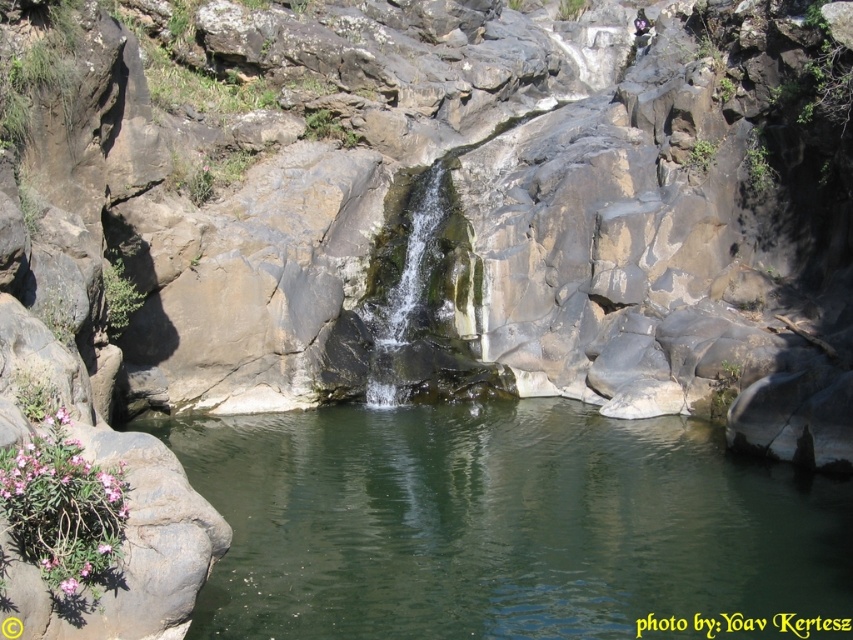
You are standing at the edge of the pool and want to locate the green smooth water at center. According to the coordinates provided, where should you look relative to your position?

The green smooth water at center is located at coordinates 0.819 on the x axis and 0.591 on the y axis, so you should look towards the right and slightly forward from your current position at the edge of the pool.

Looking at this image, you are standing at the edge of the pool and want to reach the point marked as point (x=503, y=524). Based on the scene description, is this point located on the calm water surface or on the rocky cliff? Please explain your reasoning.

The point (x=503, y=524) is located on the green smooth water at center, which is the calm pool below the waterfall. Therefore, the point is on the calm water surface.